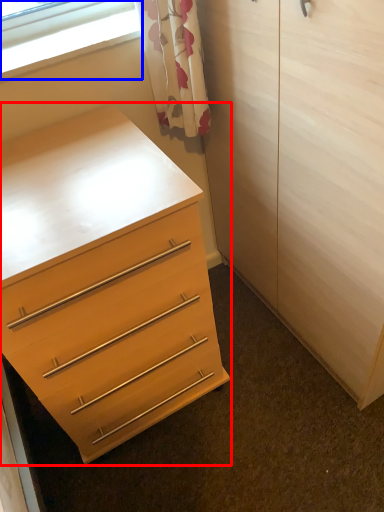
Question: Which of the following is the closest to the observer, chest of drawers (highlighted by a red box) or window (highlighted by a blue box)?

Choices:
 (A) chest of drawers
 (B) window

Answer: (A)